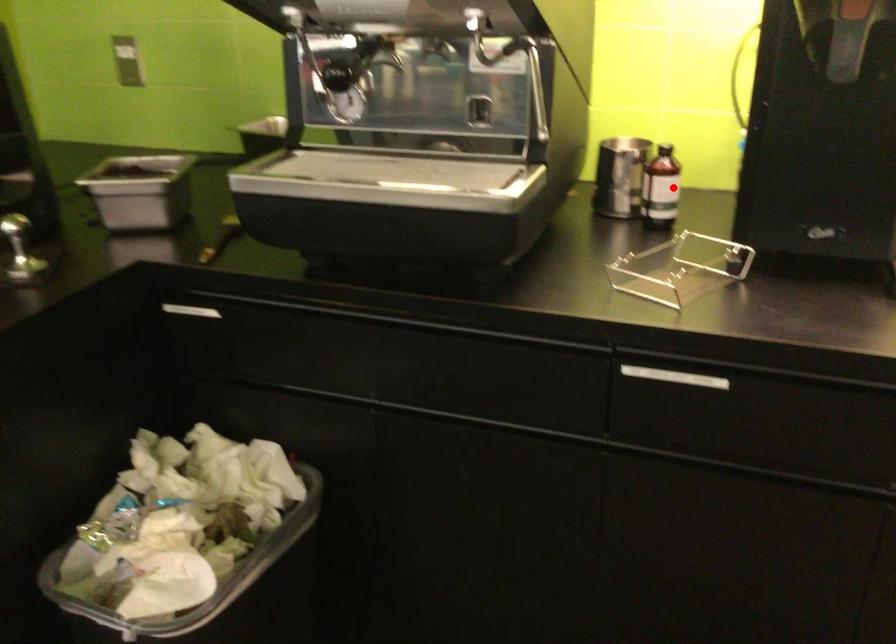
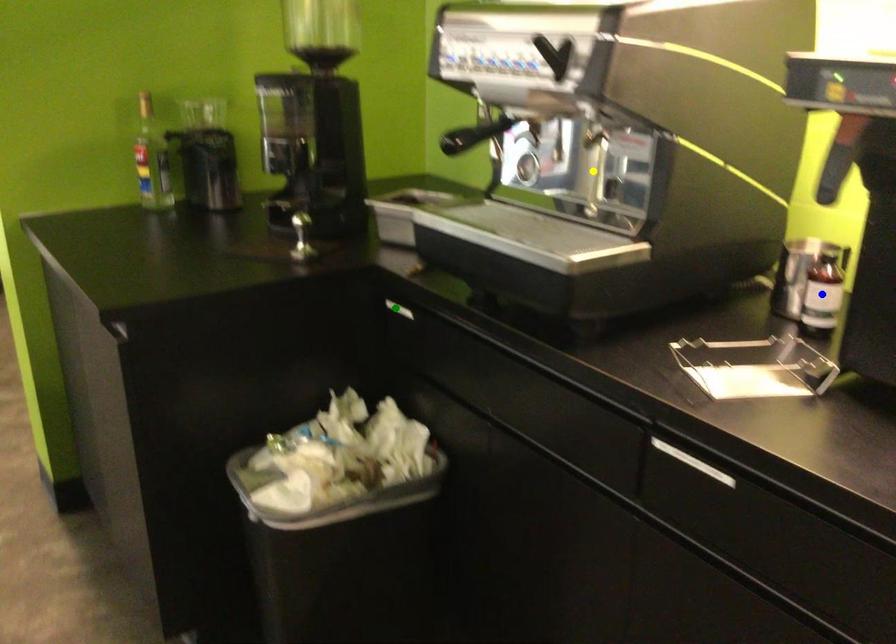
Question: I am providing you with two images of the same scene from different viewpoints. A red point is marked on the first image. You are given multiple points on the second image. Which spot in image 2 lines up with the point in image 1?

Choices:
 (A) yellow point
 (B) green point
 (C) blue point

Answer: (C)